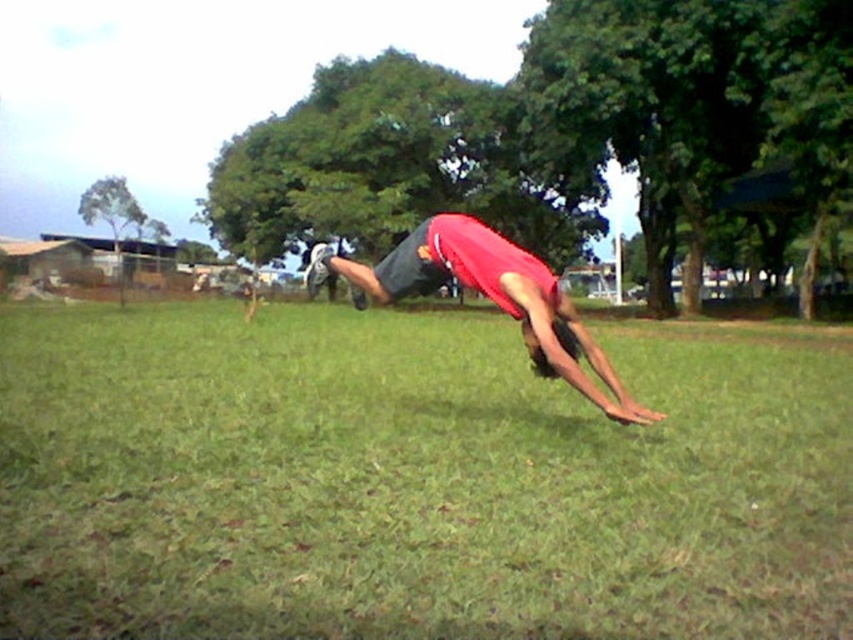
You are a photographer trying to capture the perfect shot of the person doing a backflip. You notice the green grass at center and the red matte shirt at center in your viewfinder. Which object should you focus on to ensure the subject is centered in the frame?

The red matte shirt at center should be focused on because it is positioned to the right of the green grass at center, making it closer to the center of the frame.

You are a photographer trying to capture the perfect shot of the person doing a backflip. You notice the green grass at center and the red matte shirt at center. Which object is located below the other in the image?

The green grass at center is positioned under the red matte shirt at center, so the green grass at center is below the red matte shirt at center.